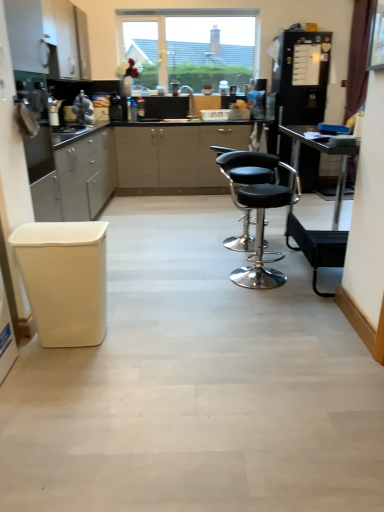
Question: Is white matte cabinet at upper left to the left of black leather stool at center from the viewer's perspective?

Choices:
 (A) yes
 (B) no

Answer: (A)

Question: Does white matte cabinet at upper left have a greater height compared to black leather stool at center?

Choices:
 (A) no
 (B) yes

Answer: (A)

Question: Is white matte cabinet at upper left located outside black leather stool at center?

Choices:
 (A) yes
 (B) no

Answer: (A)

Question: Is the depth of white matte cabinet at upper left greater than that of black leather stool at center?

Choices:
 (A) no
 (B) yes

Answer: (B)

Question: Is white matte cabinet at upper left facing towards black leather stool at center?

Choices:
 (A) no
 (B) yes

Answer: (A)

Question: Based on their sizes in the image, would you say metallic stainless steel oven at left, arranged as the third appliance when viewed from the right, is bigger or smaller than white matte cabinet at upper left?

Choices:
 (A) small
 (B) big

Answer: (A)

Question: Is metallic stainless steel oven at left, the second appliance positioned from the left, inside the boundaries of white matte cabinet at upper left, or outside?

Choices:
 (A) inside
 (B) outside

Answer: (B)

Question: From the image's perspective, is metallic stainless steel oven at left, the second appliance positioned from the left, positioned above or below white matte cabinet at upper left?

Choices:
 (A) below
 (B) above

Answer: (A)

Question: From a real-world perspective, relative to white matte cabinet at upper left, is metallic stainless steel oven at left, the 4th appliance viewed from the back, vertically above or below?

Choices:
 (A) below
 (B) above

Answer: (A)

Question: Is white woven bar stool at left, which is the second bar stool in back-to-front order, wider or thinner than black matte refrigerator at right, which ranks as the fourth appliance in left-to-right order?

Choices:
 (A) thin
 (B) wide

Answer: (A)

Question: Considering the relative positions of white woven bar stool at left, which is the 1th bar stool from front to back, and black matte refrigerator at right, the 2th appliance viewed from the back, in the image provided, is white woven bar stool at left, which is the 1th bar stool from front to back, to the left or to the right of black matte refrigerator at right, the 2th appliance viewed from the back,?

Choices:
 (A) left
 (B) right

Answer: (A)

Question: From their relative heights in the image, would you say white woven bar stool at left, the first bar stool from the left, is taller or shorter than black matte refrigerator at right, which ranks as the fourth appliance in left-to-right order?

Choices:
 (A) tall
 (B) short

Answer: (B)

Question: Is white woven bar stool at left, the first bar stool from the left, spatially inside black matte refrigerator at right, the 2th appliance viewed from the back, or outside of it?

Choices:
 (A) outside
 (B) inside

Answer: (A)

Question: Is black leather stool at center situated inside clear glass window at upper center or outside?

Choices:
 (A) outside
 (B) inside

Answer: (A)

Question: Is point pos(279,259) positioned closer to the camera than point pos(241,59)?

Choices:
 (A) closer
 (B) farther

Answer: (A)